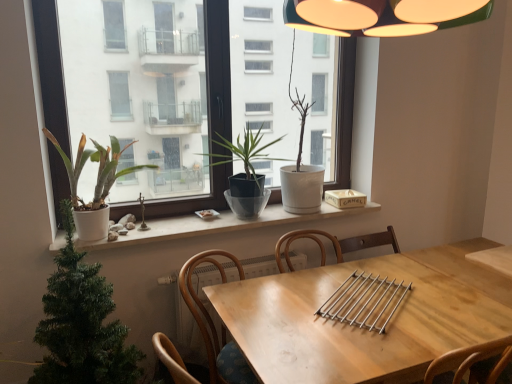
Question: From the image's perspective, is matte white window at center located above or below green matte christmas tree at lower left, acting as the third houseplant starting from the right?

Choices:
 (A) above
 (B) below

Answer: (A)

Question: Is matte white window at center taller or shorter than green matte christmas tree at lower left, the second houseplant from the left?

Choices:
 (A) tall
 (B) short

Answer: (A)

Question: Estimate the real-world distances between objects in this image. Which object is closer to the wooden at center?

Choices:
 (A) white matte pot at left, marked as the fourth houseplant in a right-to-left arrangement
 (B) white matte window sill at center
 (C) white matte pot at center, which appears as the first houseplant when viewed from the right
 (D) matte gray pot at center, which is the 2th houseplant in right-to-left order
 (E) matte white window at center

Answer: (B)

Question: Estimate the real-world distances between objects in this image. Which object is farther from the white matte pot at center, which is counted as the 4th houseplant, starting from the left?

Choices:
 (A) matte white window at center
 (B) wooden at center
 (C) white matte window sill at center
 (D) matte gray pot at center, which is the 2th houseplant in right-to-left order
 (E) white matte pot at left, marked as the fourth houseplant in a right-to-left arrangement

Answer: (A)